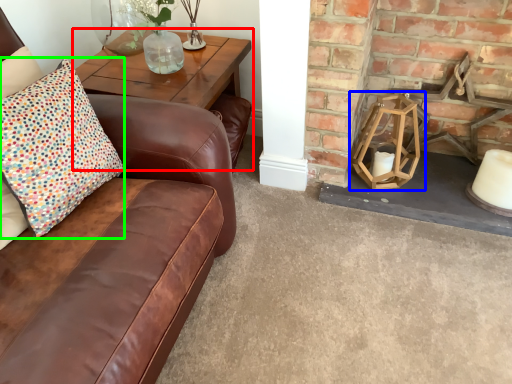
Question: Based on their relative distances, which object is farther from table (highlighted by a red box)? Choose from candle holder (highlighted by a blue box) and pillow (highlighted by a green box).

Choices:
 (A) candle holder
 (B) pillow

Answer: (A)